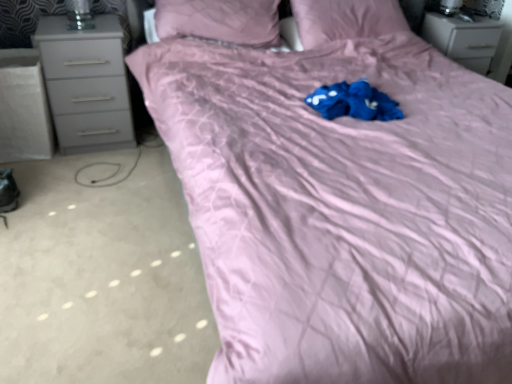
You are a GUI agent. You are given a task and a screenshot of the screen. Output one action in this format:
    pyautogui.click(x=<x>, y=<y>)
    Task: Click on the gray matte chest of drawers at left, acting as the second chest of drawers starting from the right
    This screenshot has height=384, width=512.
    Given the screenshot: What is the action you would take?
    pyautogui.click(x=86, y=84)

Find the location of a particular element. Image resolution: width=512 pixels, height=384 pixels. matte gray chest of drawers at upper right, marked as the first chest of drawers in a right-to-left arrangement is located at coordinates (464, 39).

Locate an element on the screen. matte pink pillow at upper center, which is the first pillow in left-to-right order is located at coordinates (220, 20).

Is matte gray chest of drawers at upper right, which is the second chest of drawers in front-to-back order, completely or partially outside of gray matte chest of drawers at left, acting as the second chest of drawers starting from the right?

Yes, matte gray chest of drawers at upper right, which is the second chest of drawers in front-to-back order, is not within gray matte chest of drawers at left, acting as the second chest of drawers starting from the right.

Can you confirm if matte gray chest of drawers at upper right, which is the second chest of drawers in front-to-back order, is taller than gray matte chest of drawers at left, placed as the 1th chest of drawers when sorted from left to right?

No.

Considering the positions of objects matte gray chest of drawers at upper right, the 2th chest of drawers when ordered from left to right, and gray matte chest of drawers at left, which is counted as the second chest of drawers, starting from the back, in the image provided, who is more to the left, matte gray chest of drawers at upper right, the 2th chest of drawers when ordered from left to right, or gray matte chest of drawers at left, which is counted as the second chest of drawers, starting from the back,?

gray matte chest of drawers at left, which is counted as the second chest of drawers, starting from the back, is more to the left.

Is matte gray chest of drawers at upper right, placed as the 1th chest of drawers when sorted from back to front, next to gray matte chest of drawers at left, which is counted as the second chest of drawers, starting from the back, and touching it?

No, matte gray chest of drawers at upper right, placed as the 1th chest of drawers when sorted from back to front, is not next to gray matte chest of drawers at left, which is counted as the second chest of drawers, starting from the back.

In the scene shown: Considering the relative sizes of matte pink pillow at upper center, which is the first pillow in left-to-right order, and gray matte chest of drawers at left, which is counted as the second chest of drawers, starting from the back, in the image provided, is matte pink pillow at upper center, which is the first pillow in left-to-right order, thinner than gray matte chest of drawers at left, which is counted as the second chest of drawers, starting from the back,?

In fact, matte pink pillow at upper center, which is the first pillow in left-to-right order, might be wider than gray matte chest of drawers at left, which is counted as the second chest of drawers, starting from the back.

Which is behind, point (257, 21) or point (67, 66)?

The point (257, 21) is more distant.

Based on their sizes in the image, would you say matte pink pillow at upper center, which is the first pillow in left-to-right order, is bigger or smaller than gray matte chest of drawers at left, placed as the 1th chest of drawers when sorted from left to right?

Considering their sizes, matte pink pillow at upper center, which is the first pillow in left-to-right order, takes up more space than gray matte chest of drawers at left, placed as the 1th chest of drawers when sorted from left to right.

From a real-world perspective, does matte pink pillow at upper center, which is the first pillow in left-to-right order, sit lower than gray matte chest of drawers at left, acting as the second chest of drawers starting from the right?

No, from a real-world perspective, matte pink pillow at upper center, which is the first pillow in left-to-right order, is not under gray matte chest of drawers at left, acting as the second chest of drawers starting from the right.

Is matte pink pillow at upper center, positioned as the first pillow in right-to-left order, in front of matte gray chest of drawers at upper right, the 2th chest of drawers when ordered from left to right?

Yes, the depth of matte pink pillow at upper center, positioned as the first pillow in right-to-left order, is less than that of matte gray chest of drawers at upper right, the 2th chest of drawers when ordered from left to right.

Can matte gray chest of drawers at upper right, the 2th chest of drawers when ordered from left to right, be found inside matte pink pillow at upper center, which ranks as the 2th pillow in left-to-right order?

No.

Considering the relative sizes of matte pink pillow at upper center, positioned as the first pillow in right-to-left order, and matte gray chest of drawers at upper right, the 2th chest of drawers when ordered from left to right, in the image provided, is matte pink pillow at upper center, positioned as the first pillow in right-to-left order, smaller than matte gray chest of drawers at upper right, the 2th chest of drawers when ordered from left to right,?

Actually, matte pink pillow at upper center, positioned as the first pillow in right-to-left order, might be larger than matte gray chest of drawers at upper right, the 2th chest of drawers when ordered from left to right.

Can we say matte pink pillow at upper center, which ranks as the 2th pillow in left-to-right order, lies outside gray matte chest of drawers at left, acting as the second chest of drawers starting from the right?

Yes, matte pink pillow at upper center, which ranks as the 2th pillow in left-to-right order, is outside of gray matte chest of drawers at left, acting as the second chest of drawers starting from the right.

Considering the positions of objects matte pink pillow at upper center, which ranks as the 2th pillow in left-to-right order, and gray matte chest of drawers at left, placed as the 1th chest of drawers when sorted from left to right, in the image provided, who is more to the left, matte pink pillow at upper center, which ranks as the 2th pillow in left-to-right order, or gray matte chest of drawers at left, placed as the 1th chest of drawers when sorted from left to right,?

From the viewer's perspective, gray matte chest of drawers at left, placed as the 1th chest of drawers when sorted from left to right, appears more on the left side.

Where is `chest of drawers on the left side of matte pink pillow at upper center, positioned as the first pillow in right-to-left order`? This screenshot has height=384, width=512. chest of drawers on the left side of matte pink pillow at upper center, positioned as the first pillow in right-to-left order is located at coordinates (86, 84).

Which is behind, point (374, 19) or point (64, 40)?

Point (374, 19)

Are matte pink pillow at upper center, the second pillow positioned from the right, and matte gray chest of drawers at upper right, which is the second chest of drawers in front-to-back order, far apart?

Yes, matte pink pillow at upper center, the second pillow positioned from the right, and matte gray chest of drawers at upper right, which is the second chest of drawers in front-to-back order, are located far from each other.

Which is farther, (172,34) or (468,37)?

The point (468,37) is more distant.

In terms of size, does matte pink pillow at upper center, which is the first pillow in left-to-right order, appear bigger or smaller than matte gray chest of drawers at upper right, marked as the first chest of drawers in a right-to-left arrangement?

Considering their sizes, matte pink pillow at upper center, which is the first pillow in left-to-right order, takes up more space than matte gray chest of drawers at upper right, marked as the first chest of drawers in a right-to-left arrangement.

Would you say matte pink pillow at upper center, which is the first pillow in left-to-right order, contains matte gray chest of drawers at upper right, placed as the 1th chest of drawers when sorted from back to front?

No, matte gray chest of drawers at upper right, placed as the 1th chest of drawers when sorted from back to front, is not a part of matte pink pillow at upper center, which is the first pillow in left-to-right order.

Is matte pink pillow at upper center, which is the first pillow in left-to-right order, bigger than matte pink pillow at upper center, positioned as the first pillow in right-to-left order?

Correct, matte pink pillow at upper center, which is the first pillow in left-to-right order, is larger in size than matte pink pillow at upper center, positioned as the first pillow in right-to-left order.

How much distance is there between matte pink pillow at upper center, the second pillow positioned from the right, and matte pink pillow at upper center, which ranks as the 2th pillow in left-to-right order?

matte pink pillow at upper center, the second pillow positioned from the right, is 17.24 inches from matte pink pillow at upper center, which ranks as the 2th pillow in left-to-right order.

From the image's perspective, is matte pink pillow at upper center, which is the first pillow in left-to-right order, under matte pink pillow at upper center, positioned as the first pillow in right-to-left order?

Yes, from the image's perspective, matte pink pillow at upper center, which is the first pillow in left-to-right order, is beneath matte pink pillow at upper center, positioned as the first pillow in right-to-left order.

Is matte pink pillow at upper center, the second pillow positioned from the right, turned away from matte pink pillow at upper center, which ranks as the 2th pillow in left-to-right order?

No.

Which of these two, gray matte chest of drawers at left, the first chest of drawers in the front-to-back sequence, or matte pink pillow at upper center, positioned as the first pillow in right-to-left order, is bigger?

gray matte chest of drawers at left, the first chest of drawers in the front-to-back sequence.

Could you tell me if gray matte chest of drawers at left, which is counted as the second chest of drawers, starting from the back, is turned towards matte pink pillow at upper center, which ranks as the 2th pillow in left-to-right order?

No.

Considering the positions of objects gray matte chest of drawers at left, the first chest of drawers in the front-to-back sequence, and matte pink pillow at upper center, which ranks as the 2th pillow in left-to-right order, in the image provided, who is behind, gray matte chest of drawers at left, the first chest of drawers in the front-to-back sequence, or matte pink pillow at upper center, which ranks as the 2th pillow in left-to-right order,?

matte pink pillow at upper center, which ranks as the 2th pillow in left-to-right order, is further away from the camera.

Are gray matte chest of drawers at left, placed as the 1th chest of drawers when sorted from left to right, and matte pink pillow at upper center, which ranks as the 2th pillow in left-to-right order, far apart?

Yes, gray matte chest of drawers at left, placed as the 1th chest of drawers when sorted from left to right, and matte pink pillow at upper center, which ranks as the 2th pillow in left-to-right order, are quite far apart.

You are a GUI agent. You are given a task and a screenshot of the screen. Output one action in this format:
    pyautogui.click(x=<x>, y=<y>)
    Task: Click on the chest of drawers that appears on the left of matte gray chest of drawers at upper right, the 2th chest of drawers when ordered from left to right
    This screenshot has height=384, width=512.
    Given the screenshot: What is the action you would take?
    pyautogui.click(x=86, y=84)

From a real-world perspective, which chest of drawers is the 2nd one underneath the matte pink pillow at upper center, which is the first pillow in left-to-right order? Please provide its 2D coordinates.

[(86, 84)]

From the image, which object appears to be farther from matte pink pillow at upper center, the second pillow positioned from the right, gray matte chest of drawers at left, acting as the second chest of drawers starting from the right, or matte pink pillow at upper center, positioned as the first pillow in right-to-left order?

gray matte chest of drawers at left, acting as the second chest of drawers starting from the right, lies further to matte pink pillow at upper center, the second pillow positioned from the right, than the other object.

Which object lies further to the anchor point matte gray chest of drawers at upper right, which is the second chest of drawers in front-to-back order, gray matte chest of drawers at left, placed as the 1th chest of drawers when sorted from left to right, or matte pink pillow at upper center, which ranks as the 2th pillow in left-to-right order?

Based on the image, gray matte chest of drawers at left, placed as the 1th chest of drawers when sorted from left to right, appears to be further to matte gray chest of drawers at upper right, which is the second chest of drawers in front-to-back order.

Consider the image. Estimate the real-world distances between objects in this image. Which object is closer to matte pink pillow at upper center, which ranks as the 2th pillow in left-to-right order, matte pink pillow at upper center, the second pillow positioned from the right, or matte gray chest of drawers at upper right, placed as the 1th chest of drawers when sorted from back to front?

matte pink pillow at upper center, the second pillow positioned from the right.

When comparing their distances from matte pink pillow at upper center, the second pillow positioned from the right, does matte pink pillow at upper center, positioned as the first pillow in right-to-left order, or matte gray chest of drawers at upper right, which is the second chest of drawers in front-to-back order, seem further?

matte gray chest of drawers at upper right, which is the second chest of drawers in front-to-back order, is further to matte pink pillow at upper center, the second pillow positioned from the right.

Estimate the real-world distances between objects in this image. Which object is closer to matte pink pillow at upper center, which ranks as the 2th pillow in left-to-right order, gray matte chest of drawers at left, the first chest of drawers in the front-to-back sequence, or matte pink pillow at upper center, the second pillow positioned from the right?

Based on the image, matte pink pillow at upper center, the second pillow positioned from the right, appears to be nearer to matte pink pillow at upper center, which ranks as the 2th pillow in left-to-right order.

Which object lies nearer to the anchor point matte pink pillow at upper center, which is the first pillow in left-to-right order, gray matte chest of drawers at left, the first chest of drawers in the front-to-back sequence, or matte gray chest of drawers at upper right, placed as the 1th chest of drawers when sorted from back to front?

gray matte chest of drawers at left, the first chest of drawers in the front-to-back sequence, is positioned closer to the anchor matte pink pillow at upper center, which is the first pillow in left-to-right order.

When comparing their distances from gray matte chest of drawers at left, placed as the 1th chest of drawers when sorted from left to right, does matte pink pillow at upper center, positioned as the first pillow in right-to-left order, or matte gray chest of drawers at upper right, the 2th chest of drawers when ordered from left to right, seem further?

matte gray chest of drawers at upper right, the 2th chest of drawers when ordered from left to right, is positioned further to the anchor gray matte chest of drawers at left, placed as the 1th chest of drawers when sorted from left to right.

Looking at the image, which one is located further to matte pink pillow at upper center, positioned as the first pillow in right-to-left order, matte gray chest of drawers at upper right, which is the second chest of drawers in front-to-back order, or gray matte chest of drawers at left, the first chest of drawers in the front-to-back sequence?

gray matte chest of drawers at left, the first chest of drawers in the front-to-back sequence, is positioned further to the anchor matte pink pillow at upper center, positioned as the first pillow in right-to-left order.

At what (x,y) coordinates should I click in order to perform the action: click on pillow located between matte pink pillow at upper center, the second pillow positioned from the right, and matte gray chest of drawers at upper right, which is the second chest of drawers in front-to-back order, in the left-right direction. Please return your answer as a coordinate pair (x, y). The height and width of the screenshot is (384, 512). Looking at the image, I should click on (346, 19).

Identify the location of pillow located between gray matte chest of drawers at left, which is counted as the second chest of drawers, starting from the back, and matte pink pillow at upper center, positioned as the first pillow in right-to-left order, in the left-right direction. (220, 20).